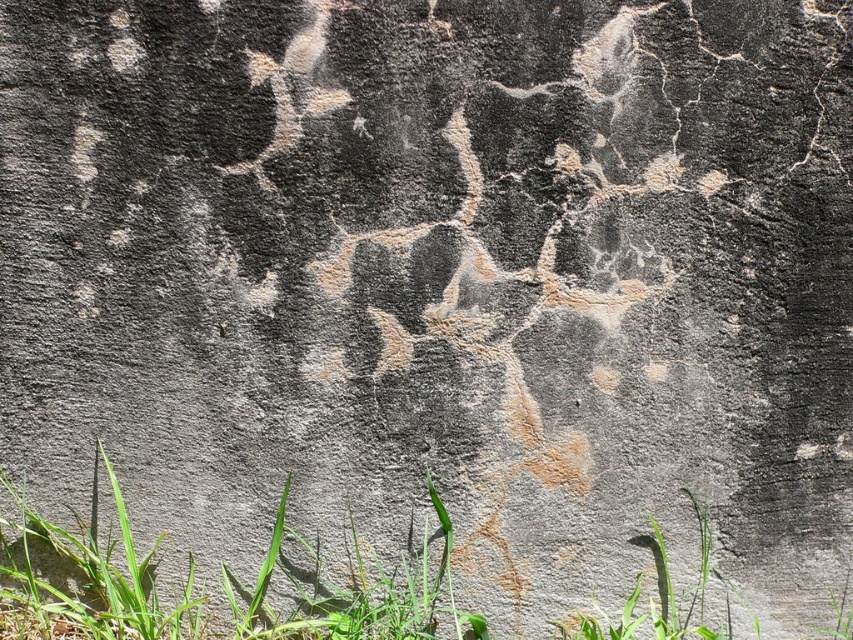
In the scene shown: Between green grass at lower left and green leafy grass at bottom, which one has less height?

With less height is green leafy grass at bottom.

Who is taller, green grass at lower left or green leafy grass at bottom?

green grass at lower left is taller.

This screenshot has height=640, width=853. Describe the element at coordinates (90, 582) in the screenshot. I see `green grass at lower left` at that location.

Identify the location of green grass at lower left. This screenshot has height=640, width=853. (90, 582).